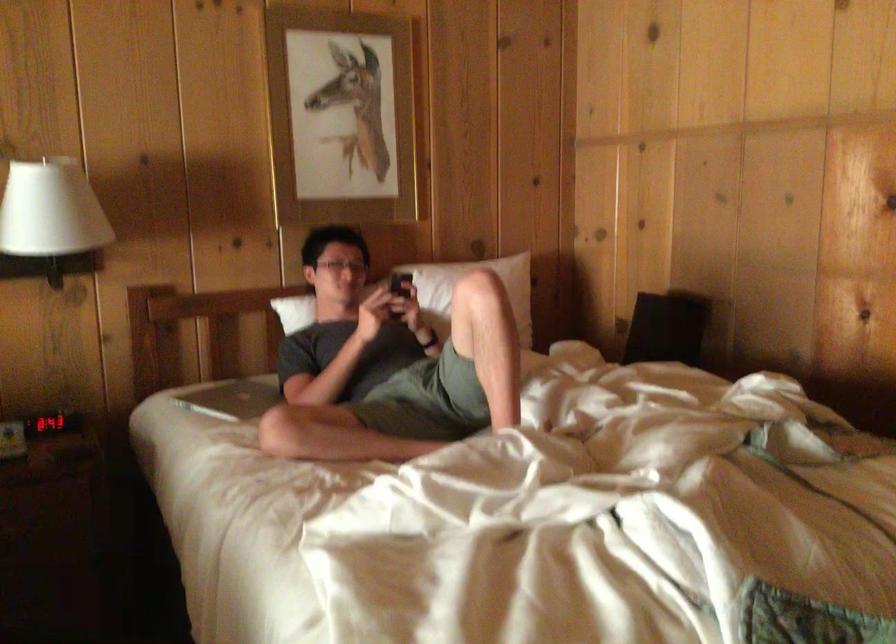
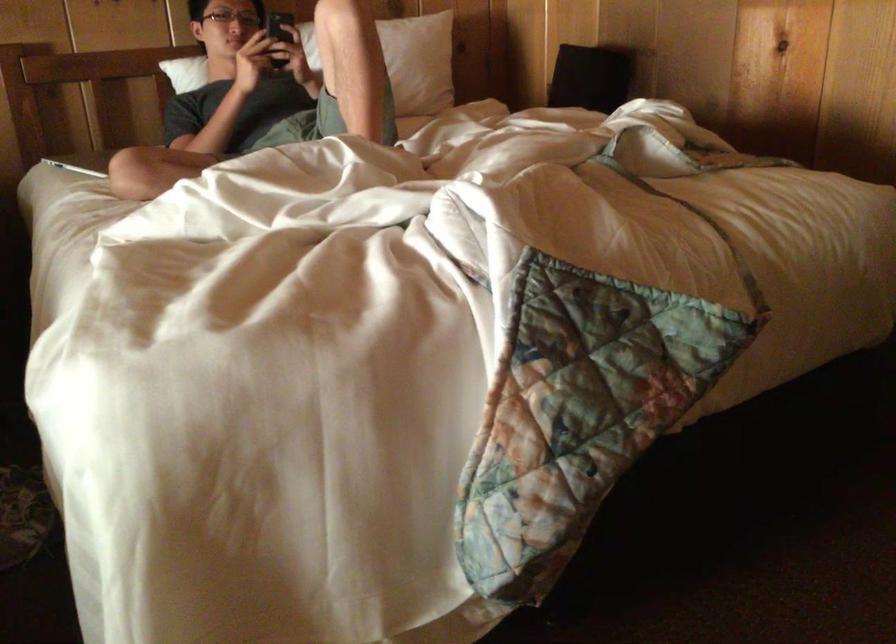
Question: The first image is from the beginning of the video and the second image is from the end. How did the camera likely rotate when shooting the video?

Choices:
 (A) Left
 (B) Right
 (C) Up
 (D) Down

Answer: (D)